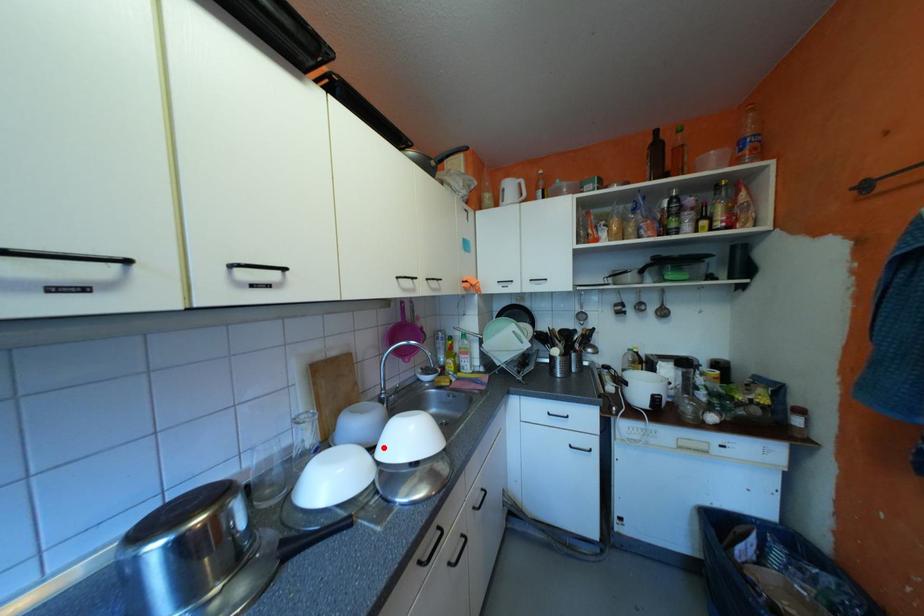
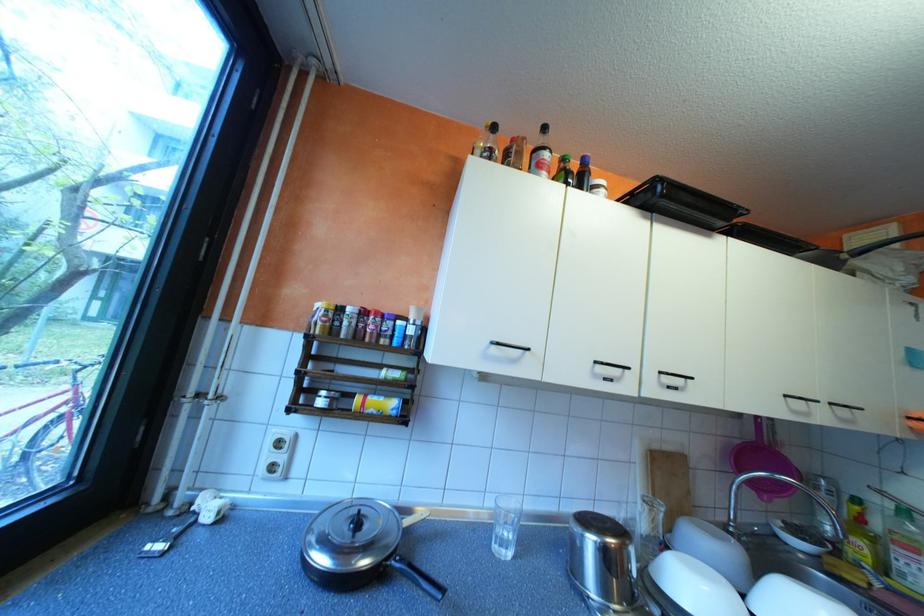
Locate, in the second image, the point that corresponds to the highlighted location in the first image.

(752, 592)